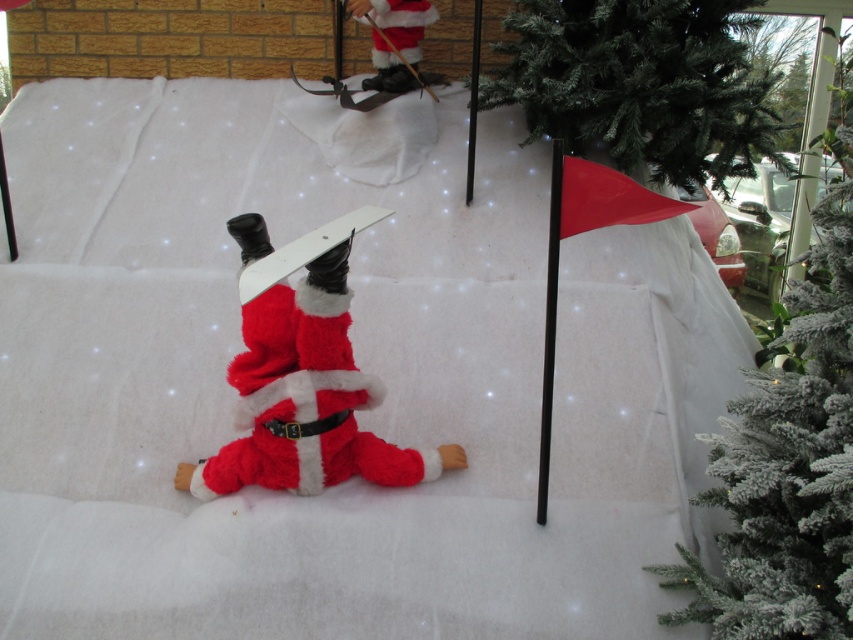
Question: Does white plastic ski at center appear under black plastic flagpole at center?

Choices:
 (A) yes
 (B) no

Answer: (A)

Question: Does fuzzy santa at upper center have a greater width compared to white plastic ski at center?

Choices:
 (A) yes
 (B) no

Answer: (B)

Question: Considering the relative positions of green matte christmas tree at upper right and white plastic ski at center in the image provided, where is green matte christmas tree at upper right located with respect to white plastic ski at center?

Choices:
 (A) right
 (B) left

Answer: (A)

Question: Estimate the real-world distances between objects in this image. Which object is farther from the white plastic ski at center?

Choices:
 (A) black matte pole at right
 (B) black plastic flagpole at center
 (C) fuzzy santa at upper center

Answer: (C)

Question: Which point is closer to the camera taking this photo?

Choices:
 (A) (543, 426)
 (B) (318, 275)
 (C) (479, 68)

Answer: (B)

Question: Among these objects, which one is farthest from the camera?

Choices:
 (A) black matte pole at right
 (B) fuzzy santa at upper center

Answer: (B)